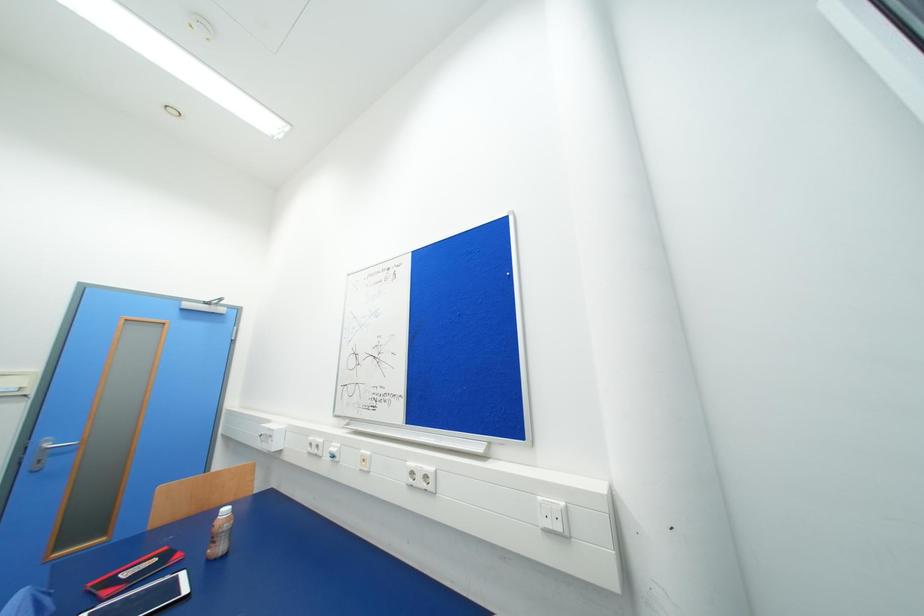
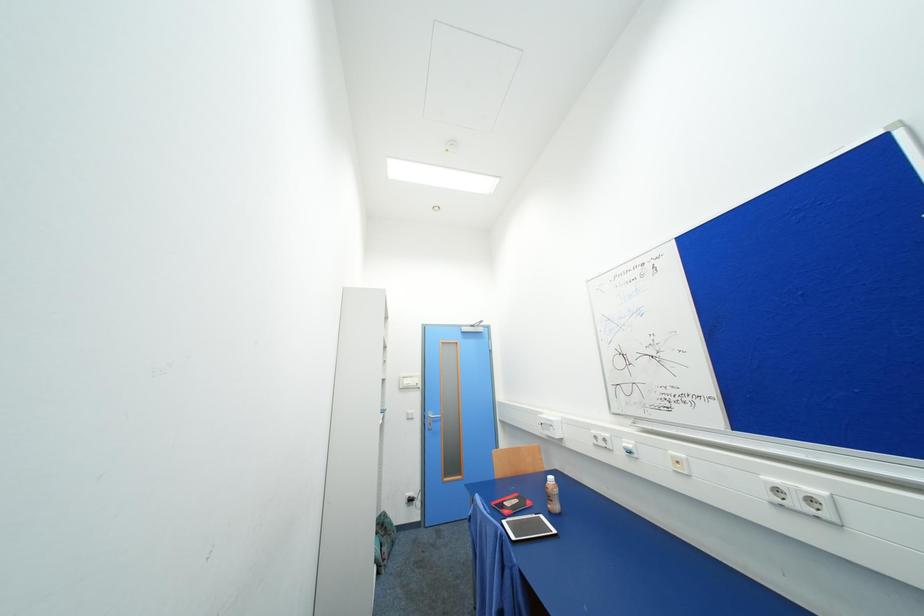
Question: The first image is from the beginning of the video and the second image is from the end. How did the camera likely rotate when shooting the video?

Choices:
 (A) Left
 (B) Right
 (C) Up
 (D) Down

Answer: (A)